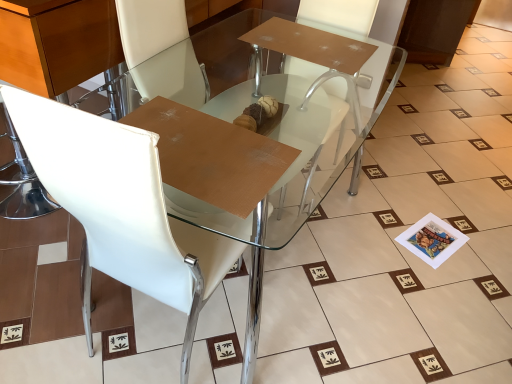
Identify the location of free space to the left of white leather chair at upper left. (51, 317).